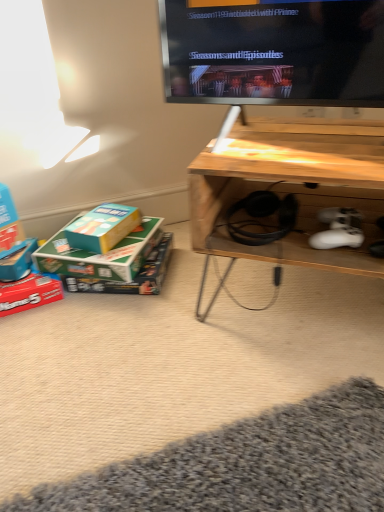
Question: From a real-world perspective, is matte blue box at lower left, arranged as the fourth box when viewed from the right, physically above green cardboard box at lower left, the third box positioned from the left?

Choices:
 (A) no
 (B) yes

Answer: (A)

Question: Does matte blue box at lower left, the first box viewed from the left, have a lesser height compared to green cardboard box at lower left, the second box from the right?

Choices:
 (A) no
 (B) yes

Answer: (A)

Question: Considering the relative sizes of matte blue box at lower left, arranged as the fourth box when viewed from the right, and green cardboard box at lower left, the third box positioned from the left, in the image provided, is matte blue box at lower left, arranged as the fourth box when viewed from the right, wider than green cardboard box at lower left, the third box positioned from the left,?

Choices:
 (A) yes
 (B) no

Answer: (B)

Question: Is the position of matte blue box at lower left, the first box viewed from the left, less distant than that of green cardboard box at lower left, the second box from the right?

Choices:
 (A) no
 (B) yes

Answer: (A)

Question: From the image's perspective, would you say matte blue box at lower left, arranged as the fourth box when viewed from the right, is positioned over green cardboard box at lower left, the third box positioned from the left?

Choices:
 (A) yes
 (B) no

Answer: (B)

Question: From a real-world perspective, relative to teal cardboard box at lower left, the fourth box in the left-to-right sequence, is green cardboard box at lower left, the third box positioned from the left, vertically above or below?

Choices:
 (A) above
 (B) below

Answer: (B)

Question: In the image, is green cardboard box at lower left, the third box positioned from the left, on the left side or the right side of teal cardboard box at lower left, the fourth box in the left-to-right sequence?

Choices:
 (A) right
 (B) left

Answer: (B)

Question: Would you say green cardboard box at lower left, the second box from the right, is inside or outside teal cardboard box at lower left, the fourth box in the left-to-right sequence?

Choices:
 (A) outside
 (B) inside

Answer: (A)

Question: Is green cardboard box at lower left, the third box positioned from the left, taller or shorter than teal cardboard box at lower left, arranged as the first box when viewed from the right?

Choices:
 (A) short
 (B) tall

Answer: (A)

Question: In the image, is wooden desk at lower right positioned in front of or behind teal cardboard box at lower left, arranged as the first box when viewed from the right?

Choices:
 (A) behind
 (B) front

Answer: (B)

Question: Considering the positions of wooden desk at lower right and teal cardboard box at lower left, arranged as the first box when viewed from the right, in the image, is wooden desk at lower right taller or shorter than teal cardboard box at lower left, arranged as the first box when viewed from the right,?

Choices:
 (A) tall
 (B) short

Answer: (A)

Question: Based on their positions, is wooden desk at lower right located to the left or right of teal cardboard box at lower left, arranged as the first box when viewed from the right?

Choices:
 (A) right
 (B) left

Answer: (A)

Question: Would you say wooden desk at lower right is inside or outside teal cardboard box at lower left, the fourth box in the left-to-right sequence?

Choices:
 (A) inside
 (B) outside

Answer: (B)

Question: Considering the positions of teal cardboard box at lower left, arranged as the first box when viewed from the right, and green cardboard box at lower left, the third box positioned from the left, in the image, is teal cardboard box at lower left, arranged as the first box when viewed from the right, taller or shorter than green cardboard box at lower left, the third box positioned from the left,?

Choices:
 (A) tall
 (B) short

Answer: (A)

Question: In terms of width, does teal cardboard box at lower left, the fourth box in the left-to-right sequence, look wider or thinner when compared to green cardboard box at lower left, the second box from the right?

Choices:
 (A) wide
 (B) thin

Answer: (B)